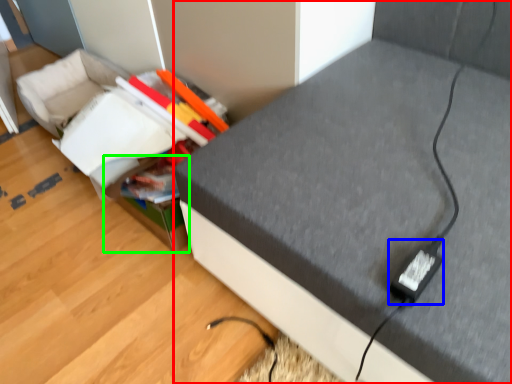
Question: Based on their relative distances, which object is farther from furniture (highlighted by a red box)? Choose from plug (highlighted by a blue box) and storage box (highlighted by a green box).

Choices:
 (A) plug
 (B) storage box

Answer: (B)